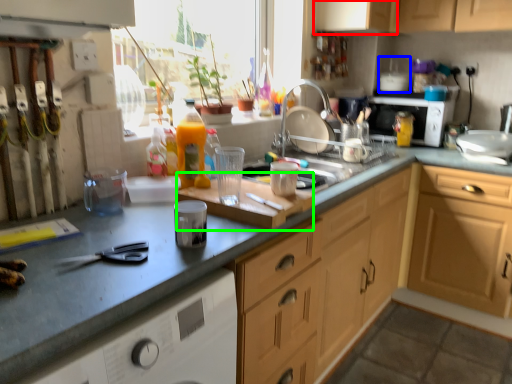
Question: Which object is the farthest from cabinetry (highlighted by a red box)? Choose among these: appliance (highlighted by a blue box) or cutting board (highlighted by a green box).

Choices:
 (A) appliance
 (B) cutting board

Answer: (B)